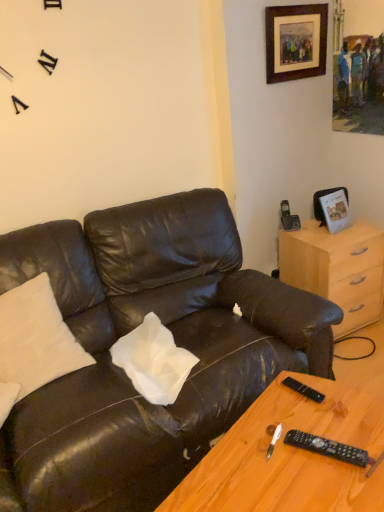
This screenshot has height=512, width=384. I want to click on vacant area located to the right-hand side of metallic silver photo frame at upper right, the first picture frame positioned from the bottom, so click(366, 229).